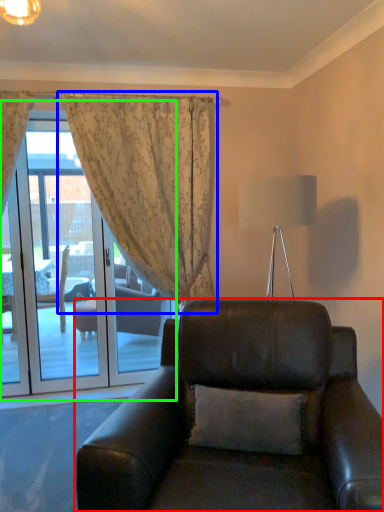
Question: Which object is the closest to the chair (highlighted by a red box)? Choose among these: curtain (highlighted by a blue box) or screen door (highlighted by a green box).

Choices:
 (A) curtain
 (B) screen door

Answer: (A)